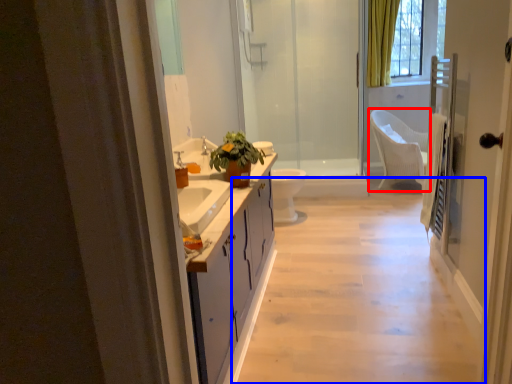
Question: Which object appears farthest to the camera in this image, chair (highlighted by a red box) or plain (highlighted by a blue box)?

Choices:
 (A) chair
 (B) plain

Answer: (A)